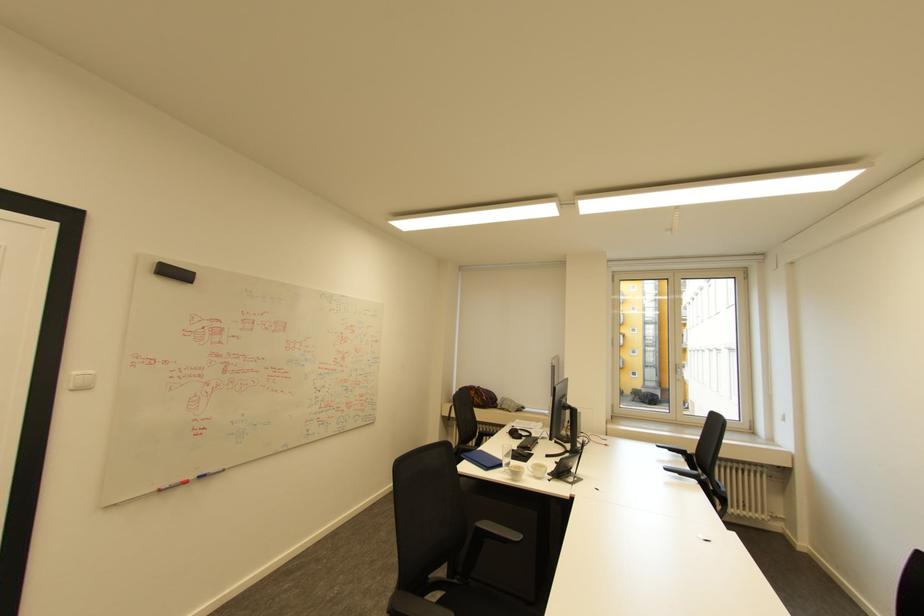
Find where to lift the telephone handset. Please return your answer as a coordinate pair (x, y).

(566, 469)